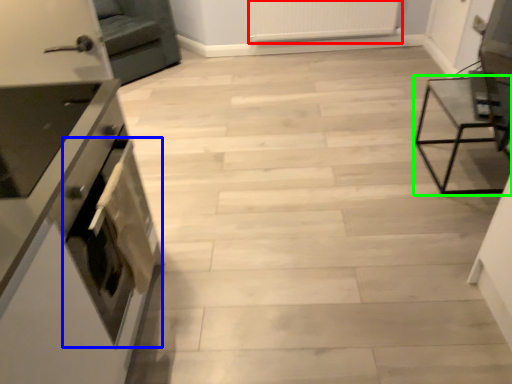
Question: Estimate the real-world distances between objects in this image. Which object is closer to radiator (highlighted by a red box), oven (highlighted by a blue box) or furniture (highlighted by a green box)?

Choices:
 (A) oven
 (B) furniture

Answer: (B)